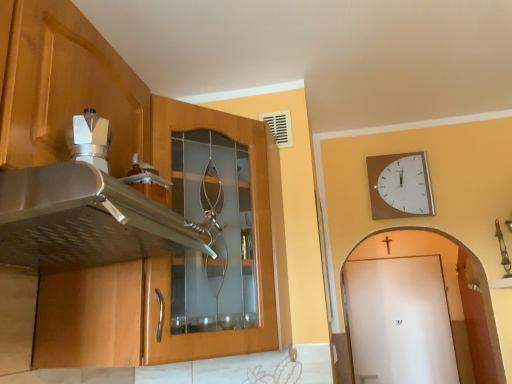
Find the location of a particular element. white matte door at right is located at coordinates (444, 274).

The image size is (512, 384). What do you see at coordinates (399, 185) in the screenshot?
I see `wooden clock at upper right` at bounding box center [399, 185].

Find the location of `white matte door at right`. white matte door at right is located at coordinates (444, 274).

What's the angular difference between white matte door at right and wooden clock at upper right's facing directions?

The angular difference between white matte door at right and wooden clock at upper right is 1.15 degrees.

Is wooden clock at upper right surrounded by white matte door at right?

No, wooden clock at upper right is located outside of white matte door at right.

This screenshot has width=512, height=384. Identify the location of door located behind the wooden clock at upper right. (444, 274).

From a real-world perspective, is white matte door at right over wooden clock at upper right?

No, from a real-world perspective, white matte door at right is not above wooden clock at upper right.

Who is taller, wooden cabinet at left or white matte door at right?

white matte door at right is taller.

How many degrees apart are the facing directions of wooden cabinet at left and white matte door at right?

They differ by 90.1 degrees in their facing directions.

Which is closer to the camera, [74,101] or [421,253]?

Clearly, point [74,101] is closer to the camera than point [421,253].

Are wooden cabinet at left and white matte door at right located far from each other?

Yes, wooden cabinet at left and white matte door at right are quite far apart.

Measure the distance between wooden clock at upper right and white matte door at right.

wooden clock at upper right is 1.80 meters from white matte door at right.

Who is taller, wooden clock at upper right or white matte door at right?

white matte door at right.

From the image's perspective, is wooden clock at upper right over white matte door at right?

Yes, from the image's perspective, wooden clock at upper right is above white matte door at right.

Can you tell me how much wooden clock at upper right and white matte door at right differ in facing direction?

The angle between the facing direction of wooden clock at upper right and the facing direction of white matte door at right is 1.15 degrees.

Is wooden clock at upper right wider or thinner than wooden cabinet at left?

Considering their sizes, wooden clock at upper right looks slimmer than wooden cabinet at left.

From a real-world perspective, is wooden clock at upper right positioned over wooden cabinet at left based on gravity?

Yes, from a real-world perspective, wooden clock at upper right is above wooden cabinet at left.

Is wooden clock at upper right to the left of wooden cabinet at left from the viewer's perspective?

In fact, wooden clock at upper right is to the right of wooden cabinet at left.

Which is more distant, (x=411, y=204) or (x=120, y=255)?

The point (x=411, y=204) is more distant.

Looking at this image, considering the relative positions of white matte door at right and wooden cabinet at left in the image provided, is white matte door at right to the left of wooden cabinet at left from the viewer's perspective?

Incorrect, white matte door at right is not on the left side of wooden cabinet at left.

How distant is white matte door at right from wooden cabinet at left?

white matte door at right is 3.11 meters from wooden cabinet at left.

In the scene shown: What's the angular difference between white matte door at right and wooden cabinet at left's facing directions?

The angular difference between white matte door at right and wooden cabinet at left is 90.1 degrees.

Locate an element on the screen. The height and width of the screenshot is (384, 512). door on the right of wooden cabinet at left is located at coordinates (444, 274).

From a real-world perspective, does wooden cabinet at left stand above wooden clock at upper right?

Actually, wooden cabinet at left is physically below wooden clock at upper right in the real world.

Which is closer to the camera, (253,147) or (422,161)?

Point (253,147)

Would you consider wooden cabinet at left to be distant from wooden clock at upper right?

Result: Yes, wooden cabinet at left is far from wooden clock at upper right.

From the image's perspective, which is above, wooden cabinet at left or wooden clock at upper right?

From the image's view, wooden clock at upper right is above.

This screenshot has width=512, height=384. I want to click on door to the right of wooden clock at upper right, so click(x=444, y=274).

You are a GUI agent. You are given a task and a screenshot of the screen. Output one action in this format:
    pyautogui.click(x=<x>, y=<y>)
    Task: Click on the cabinetry above the white matte door at right (from a real-world perspective)
    
    Given the screenshot: What is the action you would take?
    pyautogui.click(x=122, y=179)

Considering their positions, is wooden clock at upper right positioned further to white matte door at right than wooden cabinet at left?

wooden cabinet at left is further to white matte door at right.

Which object lies further to the anchor point wooden cabinet at left, wooden clock at upper right or white matte door at right?

white matte door at right.

From the image, which object appears to be farther from wooden clock at upper right, wooden cabinet at left or white matte door at right?

white matte door at right lies further to wooden clock at upper right than the other object.

Estimate the real-world distances between objects in this image. Which object is closer to wooden cabinet at left, white matte door at right or wooden clock at upper right?

Among the two, wooden clock at upper right is located nearer to wooden cabinet at left.

When comparing their distances from white matte door at right, does wooden cabinet at left or wooden clock at upper right seem closer?

Based on the image, wooden clock at upper right appears to be nearer to white matte door at right.

When comparing their distances from wooden clock at upper right, does white matte door at right or wooden cabinet at left seem further?

white matte door at right is positioned further to the anchor wooden clock at upper right.

Locate an element on the screen. This screenshot has height=384, width=512. wall clock positioned between wooden cabinet at left and white matte door at right from near to far is located at coordinates (399, 185).